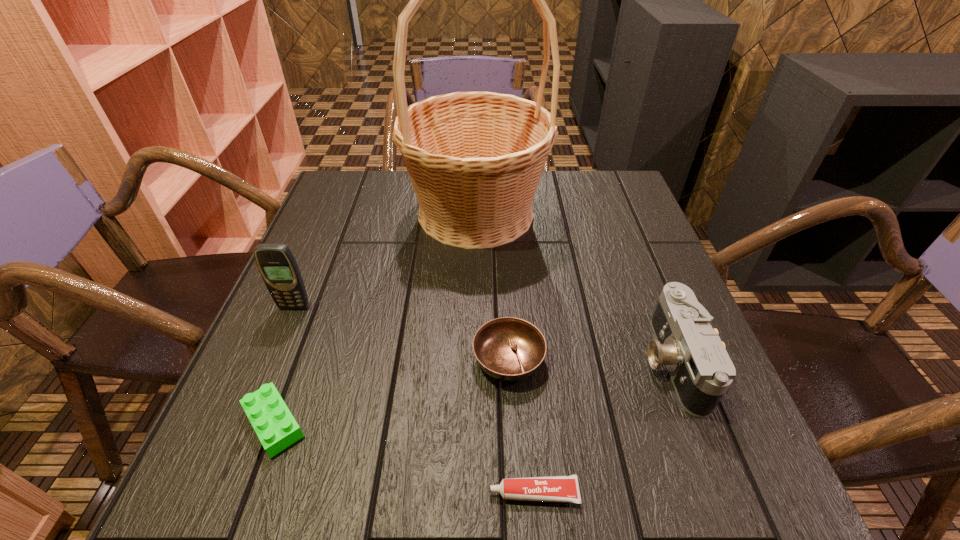
Find the location of a particular element. This screenshot has height=540, width=960. the farthest object is located at coordinates (475, 159).

Where is `basket`? The height and width of the screenshot is (540, 960). basket is located at coordinates (475, 159).

Where is `cellular telephone`? cellular telephone is located at coordinates (277, 265).

Image resolution: width=960 pixels, height=540 pixels. Find the location of `the second farthest object`. the second farthest object is located at coordinates [277, 265].

In order to click on the third tallest object in this screenshot , I will do `click(701, 371)`.

You are a GUI agent. You are given a task and a screenshot of the screen. Output one action in this format:
    pyautogui.click(x=<x>, y=<y>)
    Task: Click on the camera
    The width and height of the screenshot is (960, 540).
    Given the screenshot: What is the action you would take?
    pyautogui.click(x=701, y=371)

Find the location of `soup bowl`. soup bowl is located at coordinates (509, 349).

The height and width of the screenshot is (540, 960). I want to click on Lego, so click(275, 426).

At what (x,y) coordinates should I click in order to perform the action: click on the nearest object. Please return your answer as a coordinate pair (x, y). Looking at the image, I should click on (553, 488).

Locate an element on the screen. The height and width of the screenshot is (540, 960). toothpaste is located at coordinates (553, 488).